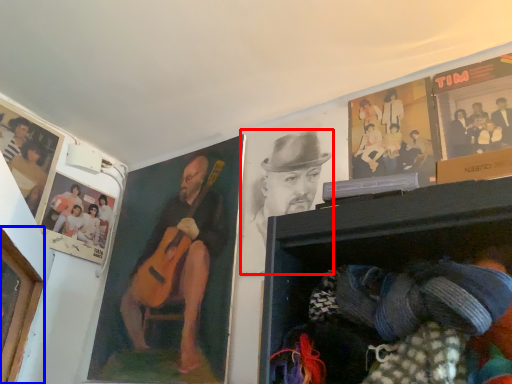
Question: Among these objects, which one is nearest to the camera, man (highlighted by a red box) or portrait (highlighted by a blue box)?

Choices:
 (A) man
 (B) portrait

Answer: (B)